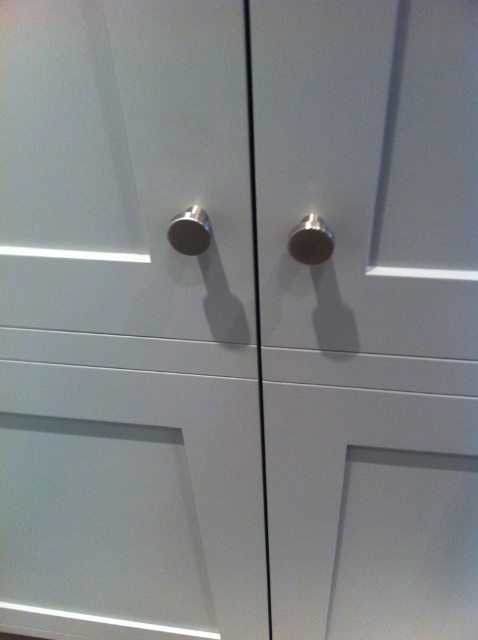
Which is above, metallic silver knob at center or polished silver knob at center?

polished silver knob at center is above.

Is point (314, 579) farther from viewer compared to point (327, 234)?

Yes, it is behind point (327, 234).

The width and height of the screenshot is (478, 640). What do you see at coordinates (369, 314) in the screenshot?
I see `metallic silver knob at center` at bounding box center [369, 314].

Find the location of a particular element. The height and width of the screenshot is (640, 478). metallic silver knob at center is located at coordinates (369, 314).

Who is lower down, polished silver knob at center or satin nickel knob at center?

polished silver knob at center

Is polished silver knob at center wider than satin nickel knob at center?

In fact, polished silver knob at center might be narrower than satin nickel knob at center.

Is point (307, 244) closer to camera compared to point (184, 241)?

Yes, it is.

Where is `polished silver knob at center`? The image size is (478, 640). polished silver knob at center is located at coordinates (311, 241).

How much distance is there between metallic silver knob at center and satin nickel knob at center?

metallic silver knob at center and satin nickel knob at center are 14.25 inches apart.

Can you confirm if metallic silver knob at center is thinner than satin nickel knob at center?

No, metallic silver knob at center is not thinner than satin nickel knob at center.

Locate an element on the screen. metallic silver knob at center is located at coordinates coord(369,314).

Identify the location of metallic silver knob at center. (369, 314).